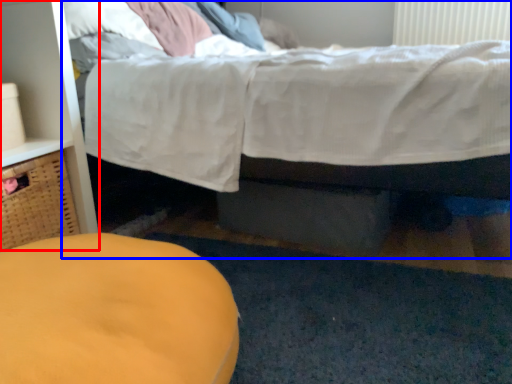
Question: Which object is further to the camera taking this photo, dresser (highlighted by a red box) or bed (highlighted by a blue box)?

Choices:
 (A) dresser
 (B) bed

Answer: (A)